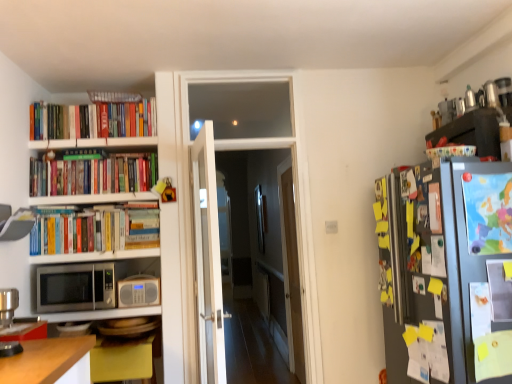
Question: Is colorful ceramic bowl at upper right touching transparent glass door at center, which is counted as the first glass door, starting from the right?

Choices:
 (A) yes
 (B) no

Answer: (B)

Question: From the image's perspective, does colorful ceramic bowl at upper right appear higher than transparent glass door at center, which is counted as the first glass door, starting from the right?

Choices:
 (A) no
 (B) yes

Answer: (B)

Question: Is colorful ceramic bowl at upper right smaller than transparent glass door at center, which is counted as the first glass door, starting from the right?

Choices:
 (A) yes
 (B) no

Answer: (A)

Question: Considering the relative sizes of colorful ceramic bowl at upper right and transparent glass door at center, the second glass door positioned from the front, in the image provided, is colorful ceramic bowl at upper right wider than transparent glass door at center, the second glass door positioned from the front,?

Choices:
 (A) no
 (B) yes

Answer: (B)

Question: Does colorful ceramic bowl at upper right appear on the right side of transparent glass door at center, the second glass door positioned from the front?

Choices:
 (A) yes
 (B) no

Answer: (A)

Question: From a real-world perspective, is colorful ceramic bowl at upper right physically above transparent glass door at center, the first glass door in the back-to-front sequence?

Choices:
 (A) yes
 (B) no

Answer: (A)

Question: Considering the relative sizes of colorful ceramic bowl at upper right and hardcover books at upper left, marked as the third book in a bottom-to-top arrangement, in the image provided, is colorful ceramic bowl at upper right smaller than hardcover books at upper left, marked as the third book in a bottom-to-top arrangement,?

Choices:
 (A) no
 (B) yes

Answer: (A)

Question: From the image's perspective, is colorful ceramic bowl at upper right over hardcover books at upper left, the 1th book in the top-to-bottom sequence?

Choices:
 (A) yes
 (B) no

Answer: (B)

Question: Can you confirm if colorful ceramic bowl at upper right is thinner than hardcover books at upper left, marked as the third book in a bottom-to-top arrangement?

Choices:
 (A) no
 (B) yes

Answer: (A)

Question: Does colorful ceramic bowl at upper right appear on the right side of hardcover books at upper left, marked as the third book in a bottom-to-top arrangement?

Choices:
 (A) no
 (B) yes

Answer: (B)

Question: Is colorful ceramic bowl at upper right placed right next to hardcover books at upper left, marked as the third book in a bottom-to-top arrangement?

Choices:
 (A) no
 (B) yes

Answer: (A)

Question: Considering the relative sizes of colorful ceramic bowl at upper right and hardcover books at upper left, marked as the third book in a bottom-to-top arrangement, in the image provided, is colorful ceramic bowl at upper right wider than hardcover books at upper left, marked as the third book in a bottom-to-top arrangement,?

Choices:
 (A) yes
 (B) no

Answer: (A)

Question: Is silver metallic microwave at lower left not within hardcover books at upper left, marked as the third book in a bottom-to-top arrangement?

Choices:
 (A) yes
 (B) no

Answer: (A)